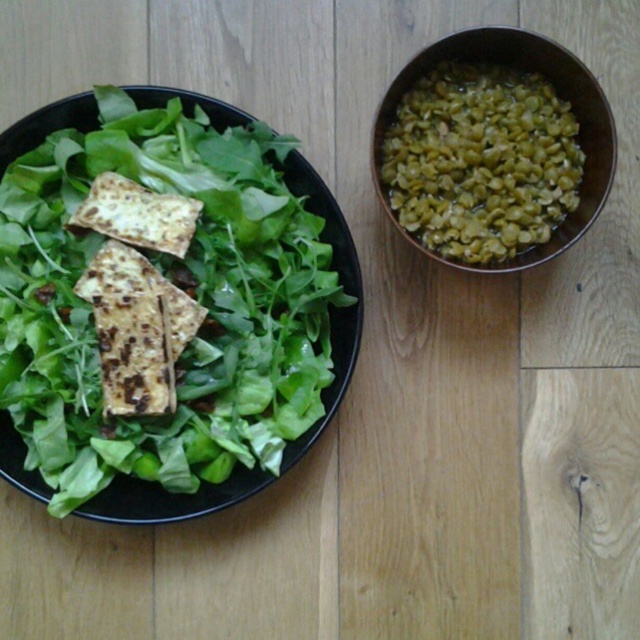
Could you measure the distance between green leafymaterial/texturevegetable at left and green matte bowl at upper right?

11.76 inches

Locate an element on the screen. This screenshot has width=640, height=640. green leafymaterial/texturevegetable at left is located at coordinates (330, 308).